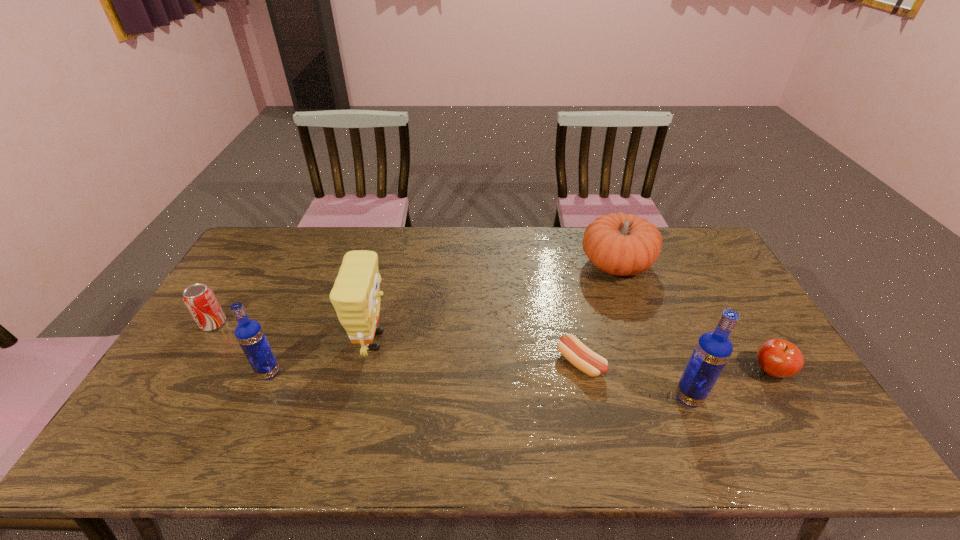
Image resolution: width=960 pixels, height=540 pixels. Identify the location of apple. (779, 358).

This screenshot has height=540, width=960. In order to click on sausage in this screenshot , I will do `click(583, 358)`.

Identify the location of the shortest object. This screenshot has height=540, width=960. (583, 358).

Where is `free space located 0.360m on the back of the shorter vodka`? The height and width of the screenshot is (540, 960). free space located 0.360m on the back of the shorter vodka is located at coordinates (311, 278).

At what (x,y) coordinates should I click in order to perform the action: click on vacant region located on the back of the nearer vodka. Please return your answer as a coordinate pair (x, y). This screenshot has height=540, width=960. Looking at the image, I should click on (660, 326).

Identify the location of vacant position located on the front of the leftmost object. Image resolution: width=960 pixels, height=540 pixels. (196, 352).

Find the location of a particular element. This screenshot has height=540, width=960. free space located on the left of the fourth tallest object is located at coordinates (518, 265).

Image resolution: width=960 pixels, height=540 pixels. Identify the location of blank area located 0.140m on the face of the sponge. [441, 341].

Identify the location of free point located on the left of the sixth tallest object. Image resolution: width=960 pixels, height=540 pixels. (625, 371).

Locate an element on the screen. The image size is (960, 540). free location located on the left of the shortest object is located at coordinates (521, 363).